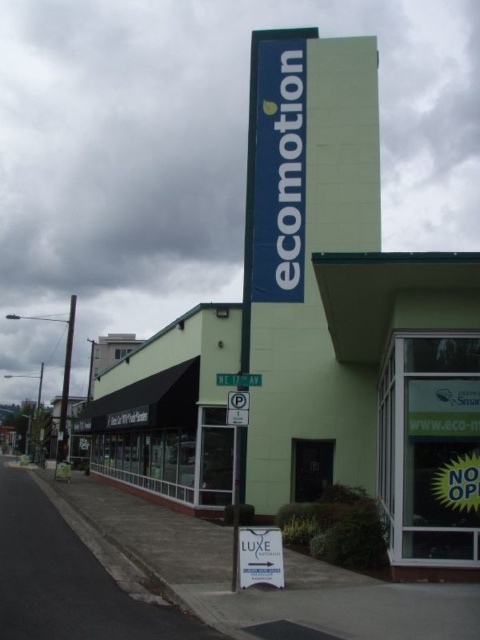
You are a delivery driver who needs to park your truck near the storefront. The truck requires a parking space that is at least 120 meters away from the green matte sign at upper center to avoid blocking the entrance. Can you park your truck near the white paper parking sign at lower center?

The green matte sign at upper center and white paper parking sign at lower center are 117.09 meters apart. Since the required distance is 120 meters, the truck cannot park near the white paper parking sign at lower center as it is too close to the green matte sign at upper center.

You are a pedestrian approaching the storefront and notice two signs. The first is the green matte sign at upper center and the second is the white paper parking sign at lower center. Which of these signs is positioned to the left when viewed from your perspective?

The green matte sign at upper center is positioned to the left of the white paper parking sign at lower center.

You are a delivery driver who needs to park your vehicle near the green matte sign at upper center and the white paper sign at center. The parking space you found is 100 meters wide. Can you park your vehicle between them without overlapping either sign?

The distance between the green matte sign at upper center and the white paper sign at center is 100.78 meters. Since the parking space is only 100 meters wide, parking between them would require a space slightly larger than available. Therefore, you cannot park between them without overlapping one of the signs.